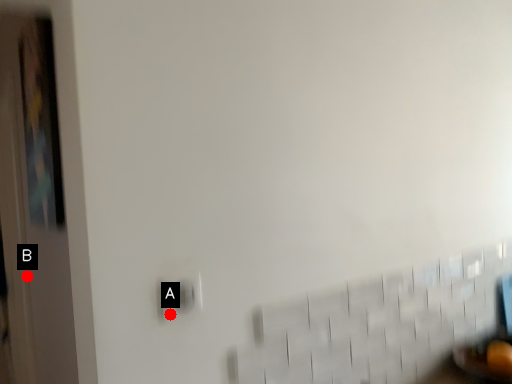
Question: Two points are circled on the image, labeled by A and B beside each circle. Which point is closer to the camera taking this photo?

Choices:
 (A) A is closer
 (B) B is closer

Answer: (A)